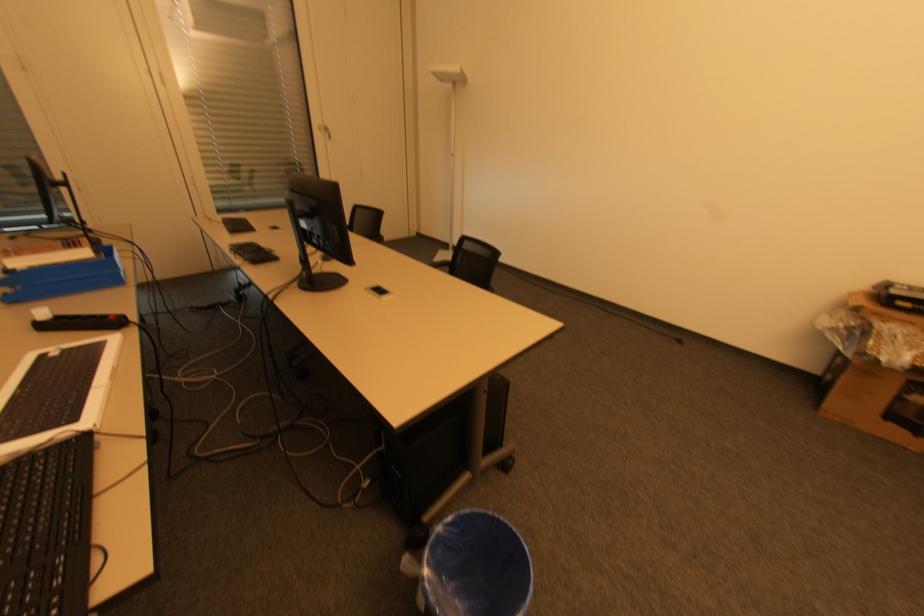
Which object does [77,321] point to?

It refers to a white smartphone.